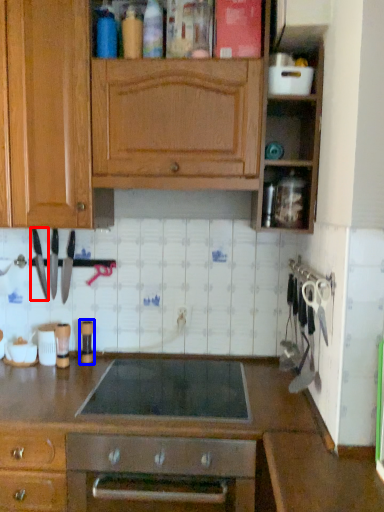
Question: Among these objects, which one is nearest to the camera, kitchen appliance (highlighted by a red box) or appliance (highlighted by a blue box)?

Choices:
 (A) kitchen appliance
 (B) appliance

Answer: (A)